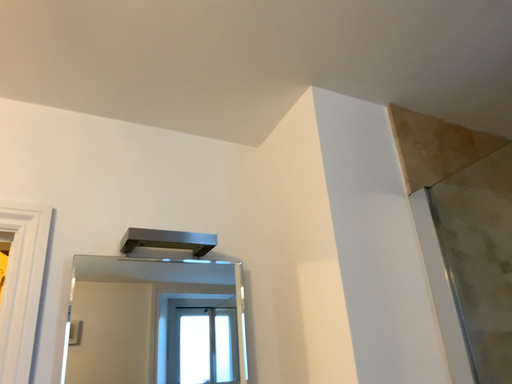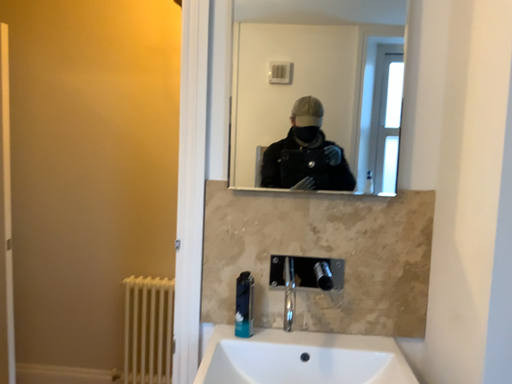
Question: How did the camera likely rotate when shooting the video?

Choices:
 (A) rotated downward
 (B) rotated upward

Answer: (A)